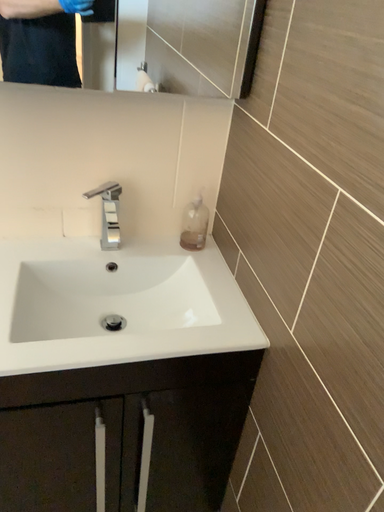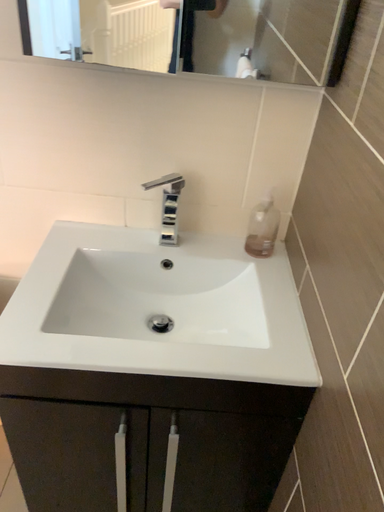
Question: Which way did the camera rotate in the video?

Choices:
 (A) rotated right
 (B) rotated left

Answer: (B)